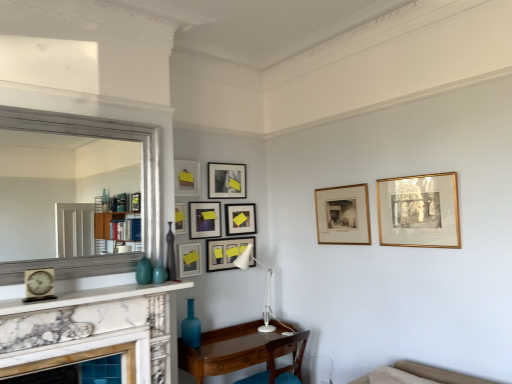
The width and height of the screenshot is (512, 384). Find the location of `free point below silver metallic mirror at left (from a real-world perspective)`. free point below silver metallic mirror at left (from a real-world perspective) is located at coordinates (104, 284).